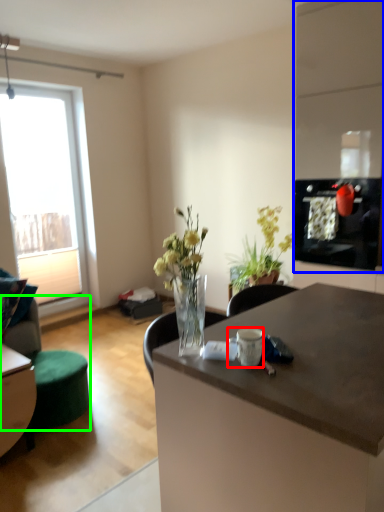
Question: Based on their relative distances, which object is nearer to coffee cup (highlighted by a red box)? Choose from cabinetry (highlighted by a blue box) and swivel chair (highlighted by a green box).

Choices:
 (A) cabinetry
 (B) swivel chair

Answer: (B)